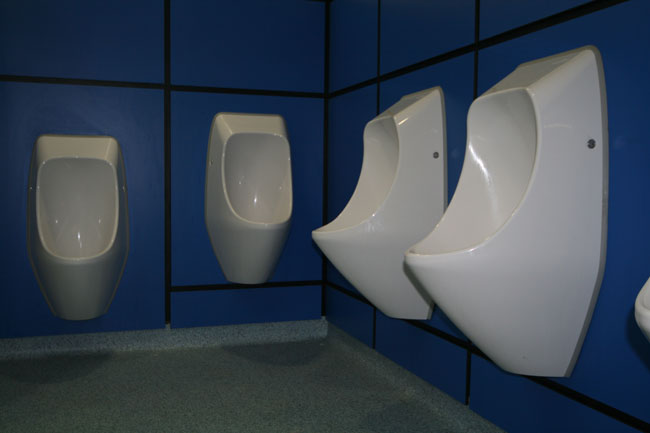
The image size is (650, 433). In order to click on side of urinal in this screenshot , I will do `click(530, 183)`, `click(462, 174)`, `click(398, 175)`, `click(361, 168)`, `click(289, 178)`, `click(223, 181)`, `click(121, 203)`, `click(34, 213)`.